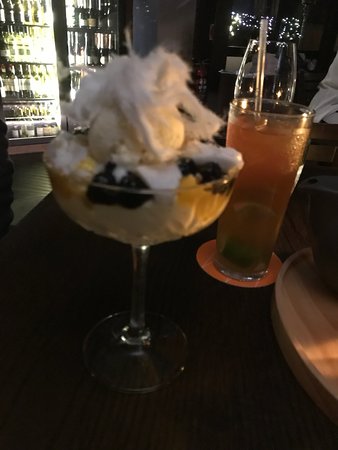
You are a GUI agent. You are given a task and a screenshot of the screen. Output one action in this format:
    pyautogui.click(x=<x>, y=<y>)
    Task: Click on the bar glass
    The height and width of the screenshot is (450, 338).
    Given the screenshot: What is the action you would take?
    pyautogui.click(x=251, y=236)